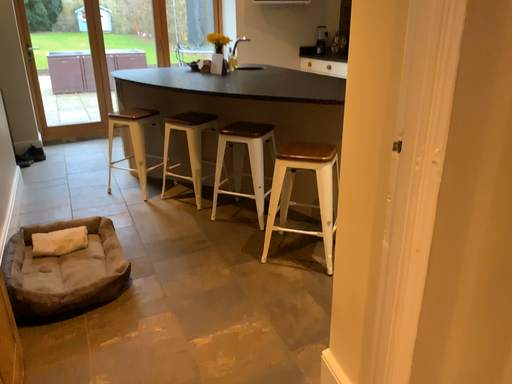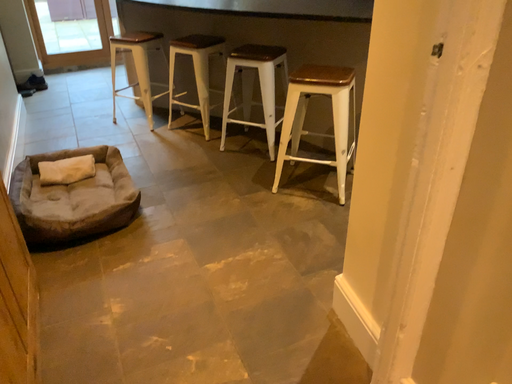
Question: Which way did the camera rotate in the video?

Choices:
 (A) rotated downward
 (B) rotated upward

Answer: (A)